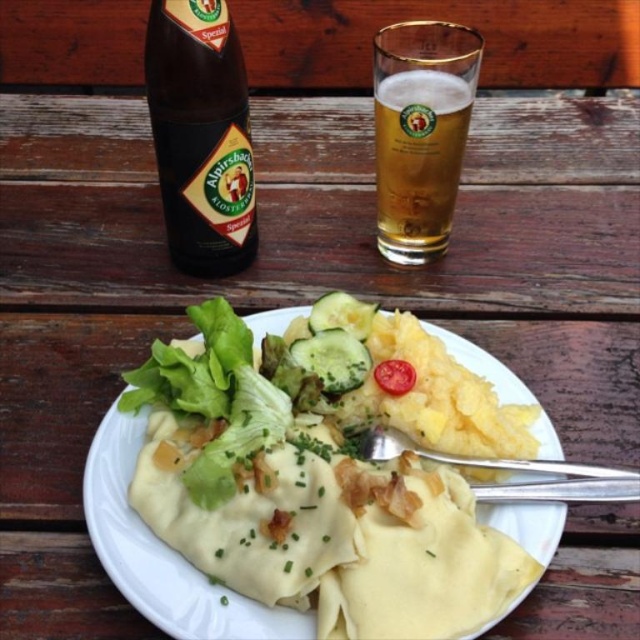
Can you confirm if white creamy dumplings at center is positioned above red smooth tomato at plate center?

Actually, white creamy dumplings at center is below red smooth tomato at plate center.

Who is taller, white creamy dumplings at center or red smooth tomato at plate center?

With more height is white creamy dumplings at center.

Does point (198, 320) come behind point (381, 365)?

Yes, it is behind point (381, 365).

You are a GUI agent. You are given a task and a screenshot of the screen. Output one action in this format:
    pyautogui.click(x=<x>, y=<y>)
    Task: Click on the white creamy dumplings at center
    This screenshot has height=640, width=640.
    Given the screenshot: What is the action you would take?
    pyautogui.click(x=305, y=499)

Who is higher up, dark brown glass bottle at upper left or red smooth tomato at plate center?

dark brown glass bottle at upper left

The height and width of the screenshot is (640, 640). I want to click on dark brown glass bottle at upper left, so click(200, 134).

Is point (230, 172) positioned behind point (410, 376)?

Yes, it is behind point (410, 376).

The image size is (640, 640). I want to click on dark brown glass bottle at upper left, so click(x=200, y=134).

Is white creamy dumplings at center thinner than dark brown glass bottle at upper left?

Incorrect, white creamy dumplings at center's width is not less than dark brown glass bottle at upper left's.

You are a GUI agent. You are given a task and a screenshot of the screen. Output one action in this format:
    pyautogui.click(x=<x>, y=<y>)
    Task: Click on the white creamy dumplings at center
    This screenshot has width=640, height=640.
    Given the screenshot: What is the action you would take?
    pyautogui.click(x=305, y=499)

Where is `white creamy dumplings at center`? The image size is (640, 640). white creamy dumplings at center is located at coordinates (305, 499).